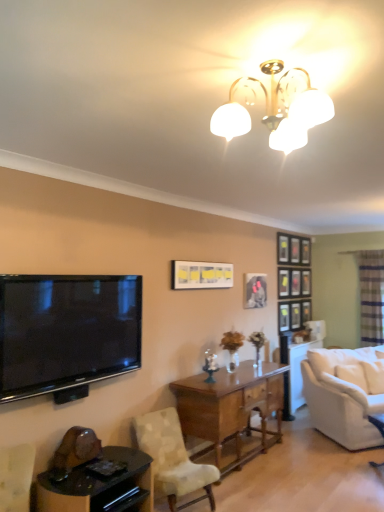
Question: Considering the relative positions of flat-screen tv at left and light beige fabric chair at center in the image provided, is flat-screen tv at left to the right of light beige fabric chair at center from the viewer's perspective?

Choices:
 (A) yes
 (B) no

Answer: (B)

Question: Can you confirm if flat-screen tv at left is wider than light beige fabric chair at center?

Choices:
 (A) no
 (B) yes

Answer: (A)

Question: Does flat-screen tv at left turn towards light beige fabric chair at center?

Choices:
 (A) no
 (B) yes

Answer: (A)

Question: Considering the relative positions of flat-screen tv at left and light beige fabric chair at center in the image provided, is flat-screen tv at left to the left of light beige fabric chair at center from the viewer's perspective?

Choices:
 (A) yes
 (B) no

Answer: (A)

Question: Is flat-screen tv at left surrounding light beige fabric chair at center?

Choices:
 (A) yes
 (B) no

Answer: (B)

Question: In the image, is black glossy table at lower left positioned in front of or behind matte black picture frame at center, which is the first picture frame in back-to-front order?

Choices:
 (A) behind
 (B) front

Answer: (B)

Question: Looking at their shapes, would you say black glossy table at lower left is wider or thinner than matte black picture frame at center, which is the first picture frame in back-to-front order?

Choices:
 (A) wide
 (B) thin

Answer: (A)

Question: Considering the positions of point (91, 492) and point (254, 273), is point (91, 492) closer or farther from the camera than point (254, 273)?

Choices:
 (A) farther
 (B) closer

Answer: (B)

Question: From a real-world perspective, is black glossy table at lower left above or below matte black picture frame at center, which appears as the first picture frame when viewed from the right?

Choices:
 (A) below
 (B) above

Answer: (A)

Question: From the image's perspective, is black glossy table at lower left located above or below translucent glass door at right?

Choices:
 (A) above
 (B) below

Answer: (B)

Question: Is black glossy table at lower left wider or thinner than translucent glass door at right?

Choices:
 (A) wide
 (B) thin

Answer: (A)

Question: Visually, is black glossy table at lower left positioned to the left or to the right of translucent glass door at right?

Choices:
 (A) left
 (B) right

Answer: (A)

Question: From a real-world perspective, relative to translucent glass door at right, is black glossy table at lower left vertically above or below?

Choices:
 (A) below
 (B) above

Answer: (A)

Question: Is matte yellow picture frame at center, which appears as the second picture frame when viewed from the back, wider or thinner than white fabric couch at right?

Choices:
 (A) wide
 (B) thin

Answer: (B)

Question: Based on their sizes in the image, would you say matte yellow picture frame at center, placed as the first picture frame when sorted from front to back, is bigger or smaller than white fabric couch at right?

Choices:
 (A) big
 (B) small

Answer: (B)